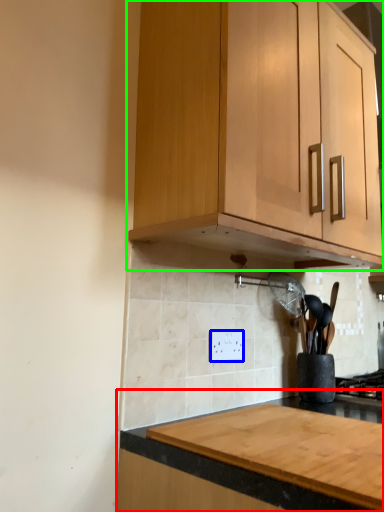
Question: Based on their relative distances, which object is nearer to countertop (highlighted by a red box)? Choose from electric outlet (highlighted by a blue box) and cabinetry (highlighted by a green box).

Choices:
 (A) electric outlet
 (B) cabinetry

Answer: (A)